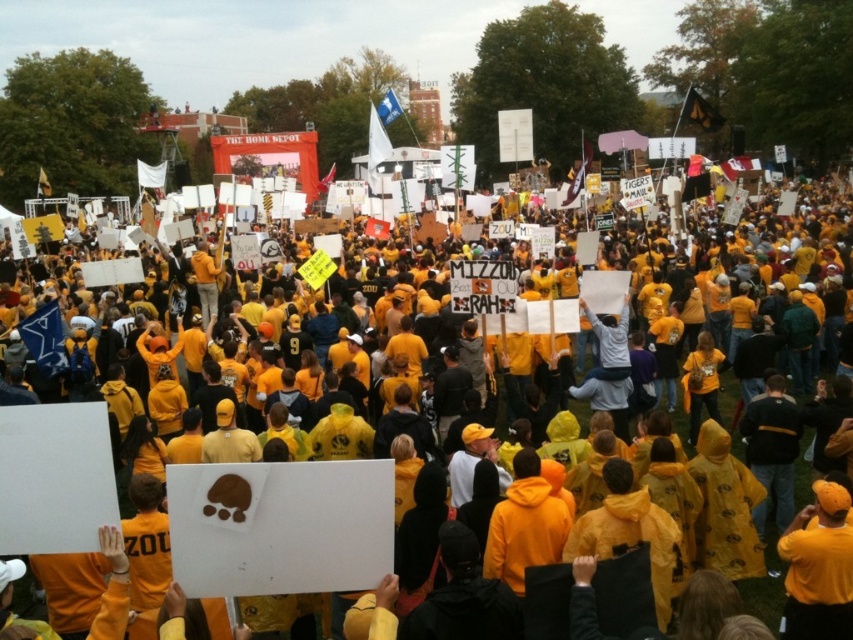
You are a photographer at the event and want to capture both the yellow matte raincoat at center and the light gray sweater at center in a single photo. Which object should you position to the left side of your frame to ensure both are included?

You should position the light gray sweater at center on the left side of your frame because the yellow matte raincoat at center is to the right of it, ensuring both are captured in the photo.